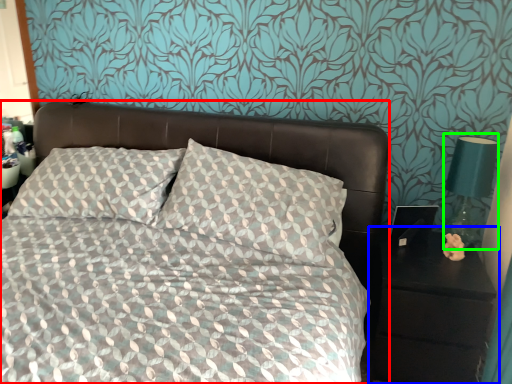
Question: Considering the real-world distances, which object is closest to bed (highlighted by a red box)? nightstand (highlighted by a blue box) or bedside lamp (highlighted by a green box).

Choices:
 (A) nightstand
 (B) bedside lamp

Answer: (A)